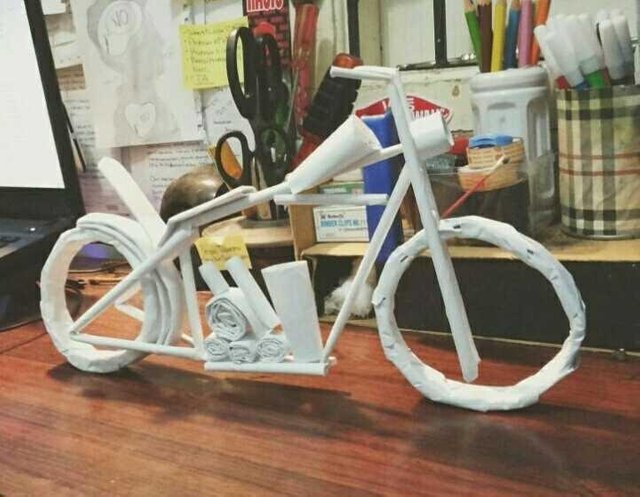
Please find post it note in the image and show me where they are. Your answer should be formatted as a list of tuples, i.e. [(x1, y1), (x2, y2), ...], where each tuple contains the x and y coordinates of a point satisfying the conditions above.

[(212, 246)]